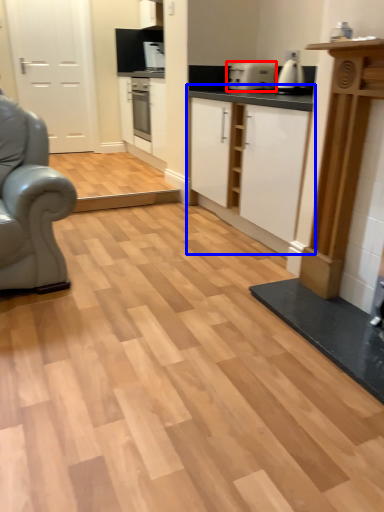
Question: Which of the following is the farthest to the observer, appliance (highlighted by a red box) or cabinetry (highlighted by a blue box)?

Choices:
 (A) appliance
 (B) cabinetry

Answer: (A)